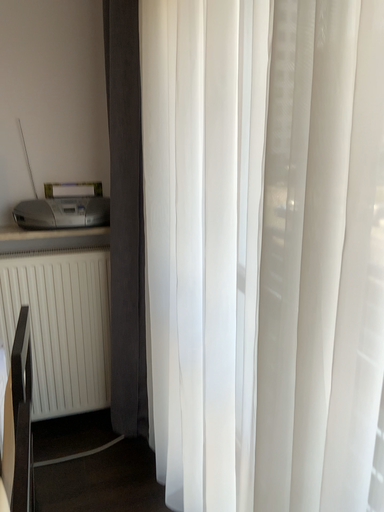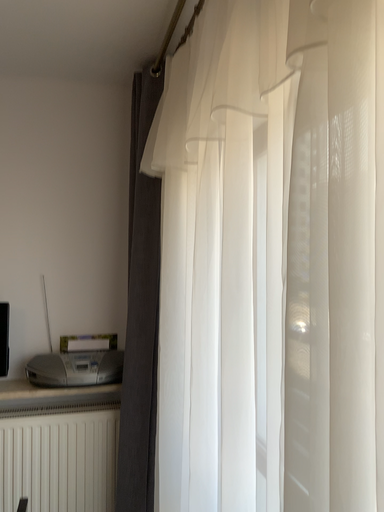
Question: How did the camera likely rotate when shooting the video?

Choices:
 (A) rotated downward
 (B) rotated upward

Answer: (B)